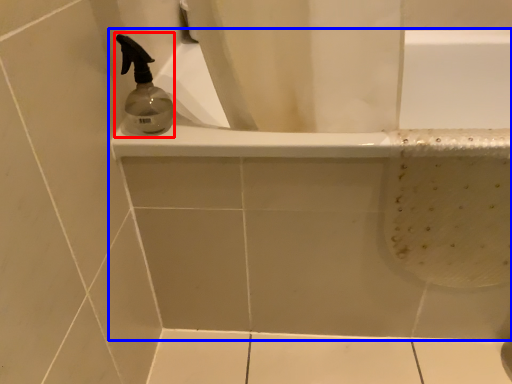
Question: Which object appears closest to the camera in this image, soap dispenser (highlighted by a red box) or bathtub (highlighted by a blue box)?

Choices:
 (A) soap dispenser
 (B) bathtub

Answer: (A)